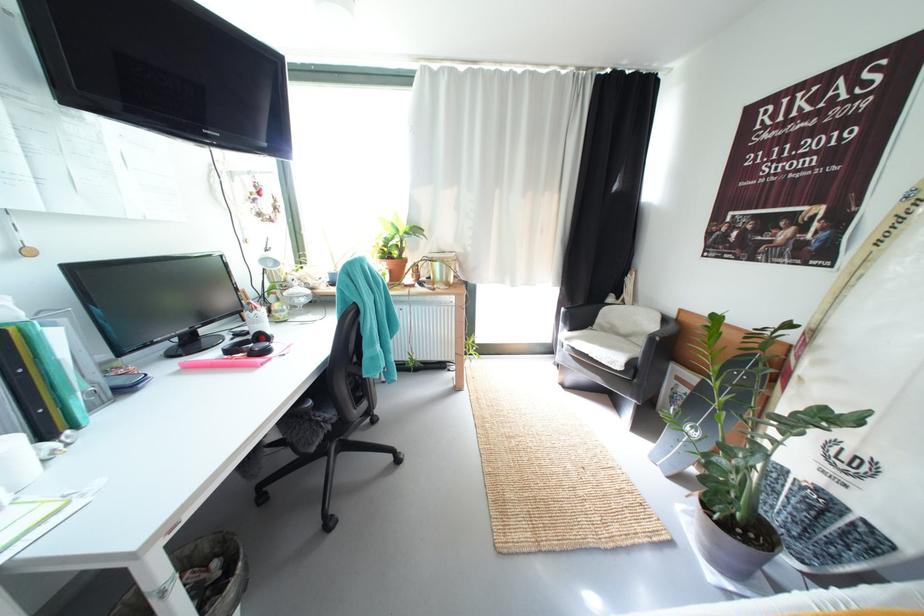
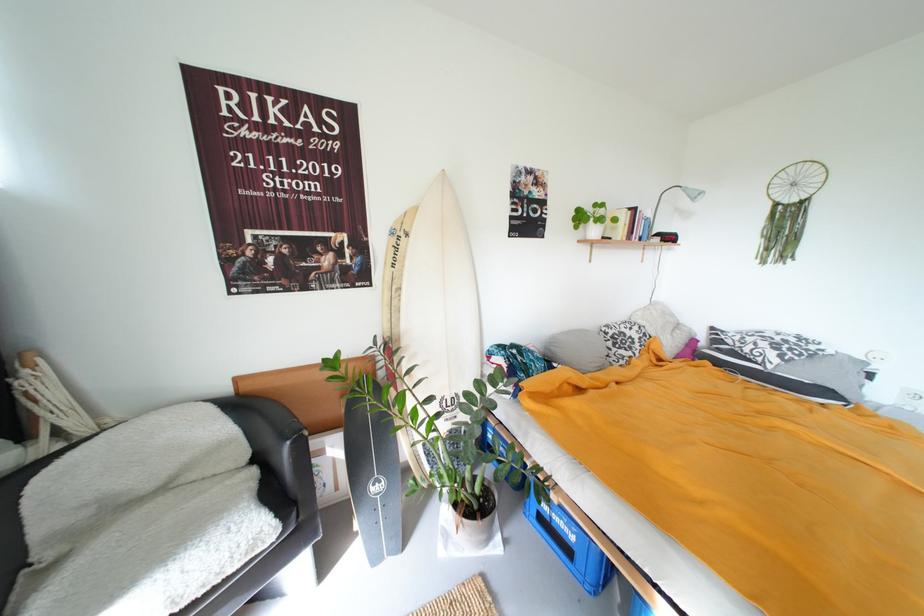
In the second image, find the point that corresponds to pixel 713 543 in the first image.

(492, 539)